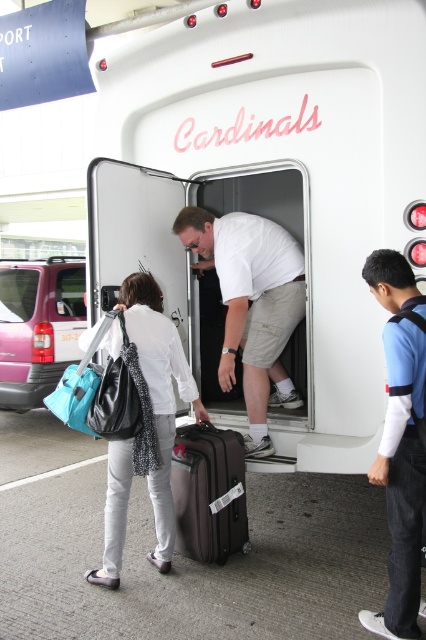
Consider the image. Who is higher up, matte black bag at left or matte pink van at left?

Positioned higher is matte pink van at left.

Between point (112, 560) and point (20, 349), which one is positioned in front?

Point (112, 560)

This screenshot has width=426, height=640. I want to click on matte black bag at left, so click(158, 394).

In the scene shown: Is matte pink van at left to the right of matte black suitcase at center from the viewer's perspective?

In fact, matte pink van at left is to the left of matte black suitcase at center.

Who is positioned more to the left, matte pink van at left or matte black suitcase at center?

From the viewer's perspective, matte pink van at left appears more on the left side.

This screenshot has width=426, height=640. What are the coordinates of `matte pink van at left` in the screenshot? It's located at (37, 326).

Can you confirm if white matte shirt at center is smaller than matte pink van at left?

Yes.

Between white matte shirt at center and matte pink van at left, which one has more height?

matte pink van at left is taller.

Image resolution: width=426 pixels, height=640 pixels. In order to click on white matte shirt at center in this screenshot , I will do `click(252, 305)`.